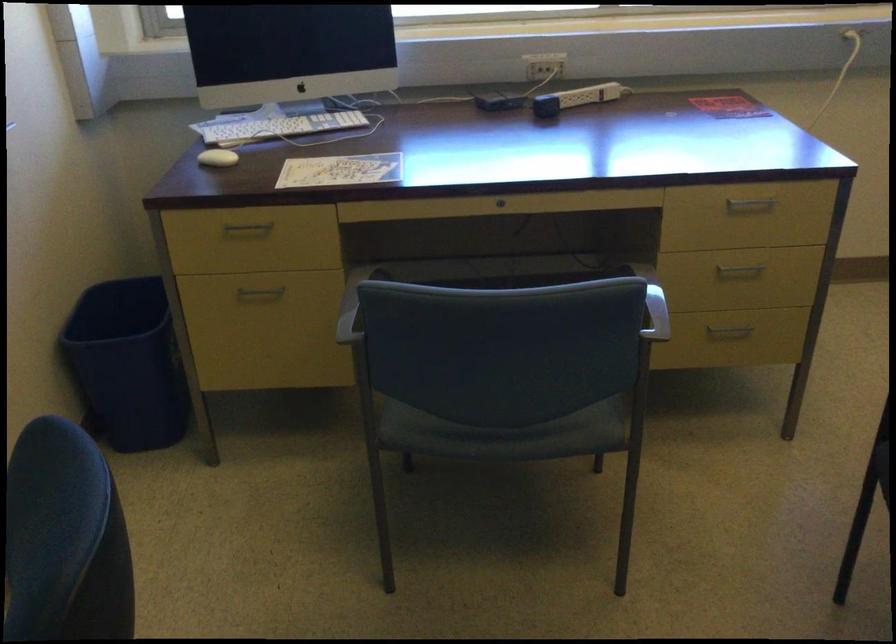
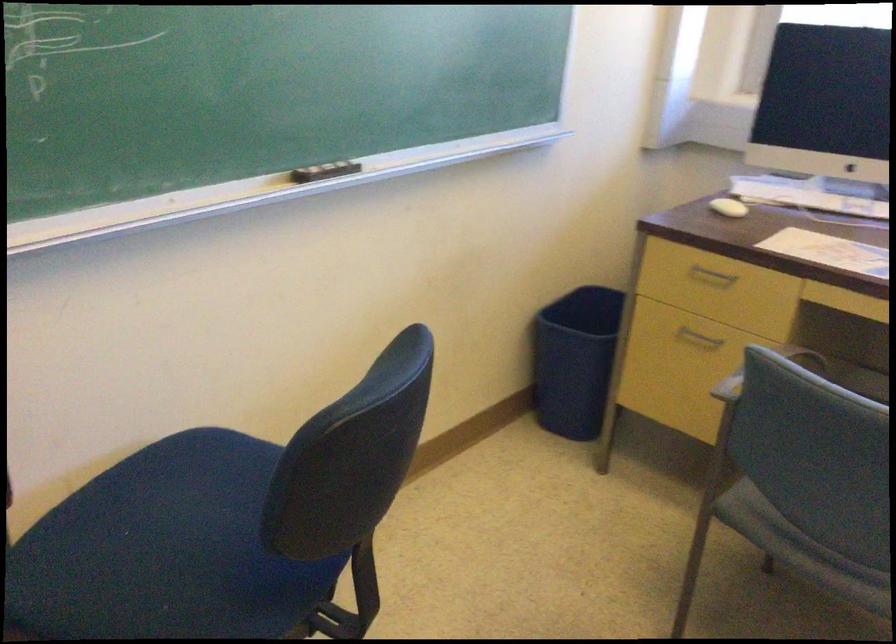
The point at (462, 440) is marked in the first image. Where is the corresponding point in the second image?

(800, 549)